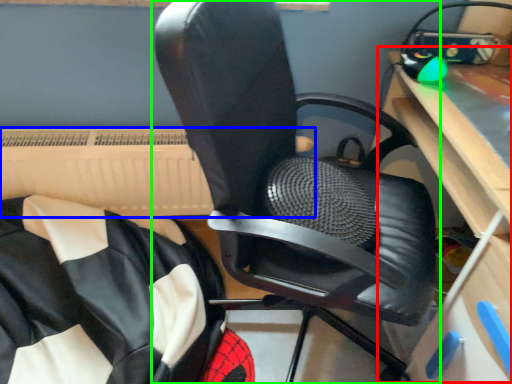
Question: Estimate the real-world distances between objects in this image. Which object is farther from computer desk (highlighted by a red box), radiator (highlighted by a blue box) or chair (highlighted by a green box)?

Choices:
 (A) radiator
 (B) chair

Answer: (A)